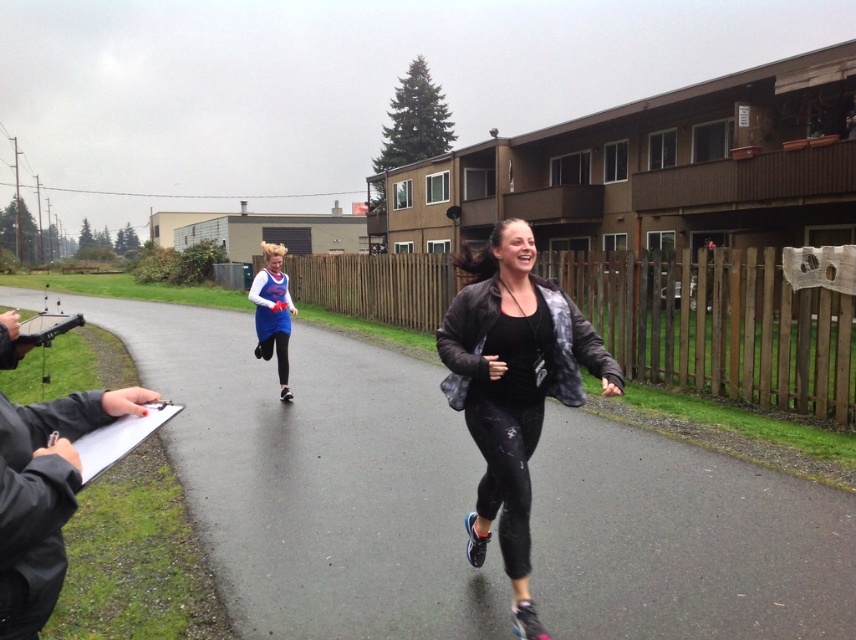
Question: Which point is closer to the camera?

Choices:
 (A) black matte jacket at center
 (B) blue jersey at center

Answer: (A)

Question: Can you confirm if black matte jacket at center is smaller than blue jersey at center?

Choices:
 (A) no
 (B) yes

Answer: (B)

Question: Which object appears farthest from the camera in this image?

Choices:
 (A) blue jersey at center
 (B) black matte jacket at center

Answer: (A)

Question: Which object appears farthest from the camera in this image?

Choices:
 (A) black matte jacket at center
 (B) blue jersey at center

Answer: (B)

Question: Can you confirm if black matte jacket at center is bigger than blue jersey at center?

Choices:
 (A) yes
 (B) no

Answer: (B)

Question: Can you confirm if black matte jacket at center is positioned to the right of blue jersey at center?

Choices:
 (A) yes
 (B) no

Answer: (A)